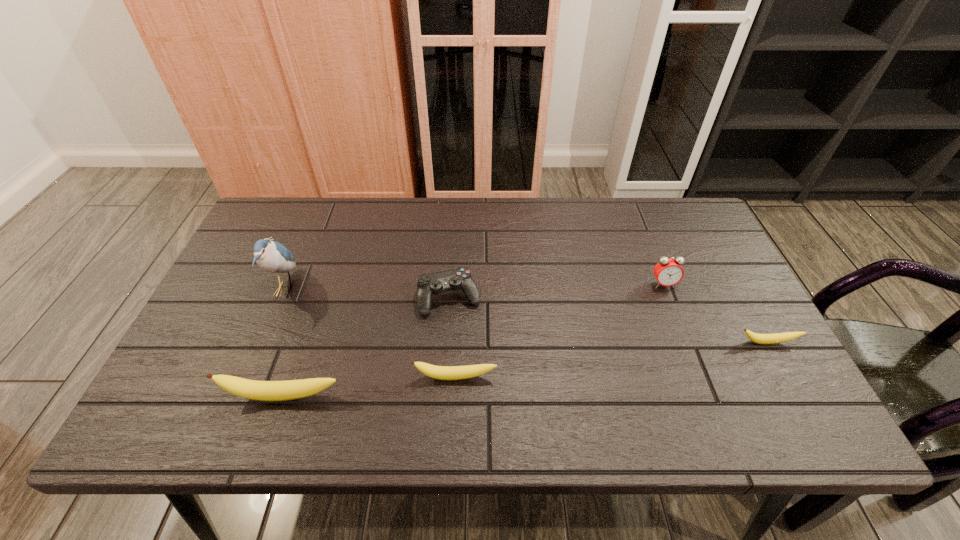
Find the location of a particular element. Image resolution: width=960 pixels, height=540 pixels. vacant area that lies between the control and the second banana from right to left is located at coordinates (452, 338).

Locate which object ranks fourth in proximity to the second nearest banana. Please provide its 2D coordinates. Your answer should be formatted as a tuple, i.e. [(x, y)], where the tuple contains the x and y coordinates of a point satisfying the conditions above.

[(668, 271)]

I want to click on object that stands as the closest to the control, so click(x=437, y=372).

This screenshot has height=540, width=960. I want to click on banana that is the second closest to the second nearest object, so click(757, 338).

Locate an element on the screen. The width and height of the screenshot is (960, 540). banana identified as the closest to the alarm clock is located at coordinates (757, 338).

The width and height of the screenshot is (960, 540). Find the location of `vacant region that satisfies the following two spatial constraints: 1. at the tip of the bird's beak; 2. on the back side of the control`. vacant region that satisfies the following two spatial constraints: 1. at the tip of the bird's beak; 2. on the back side of the control is located at coordinates (281, 298).